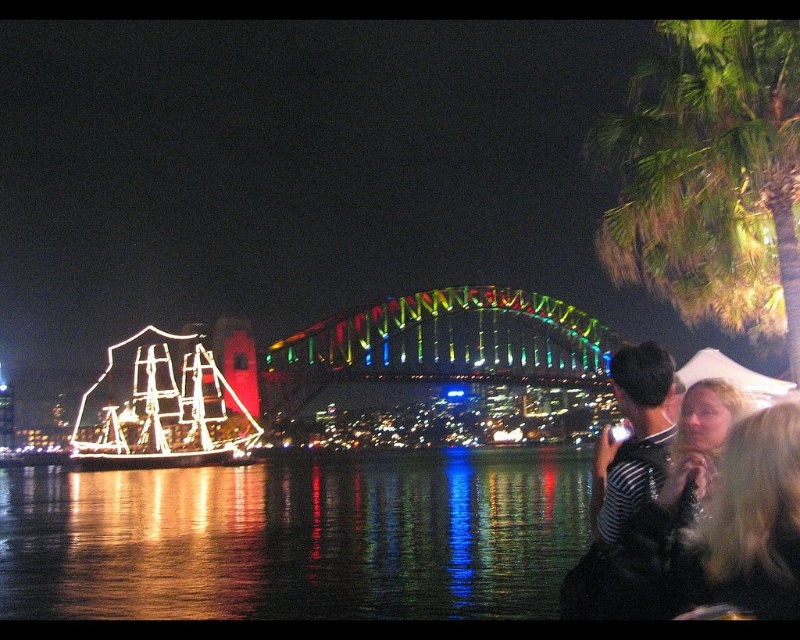
Question: Does glossy reflective water at center lie behind white wireframe boat at left?

Choices:
 (A) yes
 (B) no

Answer: (B)

Question: Does glossy reflective water at center have a lesser width compared to blonde hair at lower right?

Choices:
 (A) yes
 (B) no

Answer: (B)

Question: Among these objects, which one is farthest from the camera?

Choices:
 (A) green leafy palm tree at upper right
 (B) white wireframe boat at left
 (C) blonde hair at lower right

Answer: (B)

Question: Is glossy reflective water at center smaller than green leafy palm tree at upper right?

Choices:
 (A) no
 (B) yes

Answer: (B)

Question: Based on their relative distances, which object is farther from the glossy reflective water at center?

Choices:
 (A) blonde hair at lower right
 (B) white wireframe boat at left
 (C) striped fabric couple at right

Answer: (A)

Question: Among these objects, which one is nearest to the camera?

Choices:
 (A) green leafy palm tree at upper right
 (B) white wireframe boat at left
 (C) glossy reflective water at center

Answer: (C)